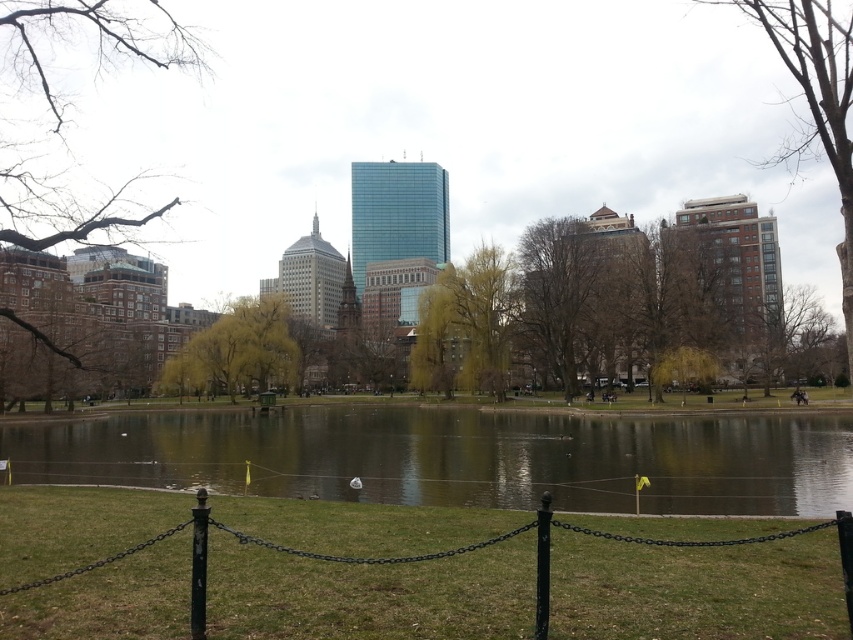
Is brown leafy tree at left above yellow-green leaves at center?

Yes, brown leafy tree at left is above yellow-green leaves at center.

Who is shorter, brown leafy tree at left or yellow-green leaves at center?

yellow-green leaves at center

The width and height of the screenshot is (853, 640). What do you see at coordinates (67, 108) in the screenshot?
I see `brown leafy tree at left` at bounding box center [67, 108].

I want to click on brown leafy tree at left, so coord(67,108).

Is green reflective water at center to the right of green leafy tree at center from the viewer's perspective?

Correct, you'll find green reflective water at center to the right of green leafy tree at center.

Is green reflective water at center positioned at the back of green leafy tree at center?

No, it is not.

This screenshot has width=853, height=640. Find the location of `green reflective water at center`. green reflective water at center is located at coordinates point(459,458).

Can you confirm if brown textured tree at center is positioned below yellow-green leaves at center?

Incorrect, brown textured tree at center is not positioned below yellow-green leaves at center.

Who is shorter, brown textured tree at center or yellow-green leaves at center?

With less height is yellow-green leaves at center.

The height and width of the screenshot is (640, 853). Identify the location of brown textured tree at center. (560, 294).